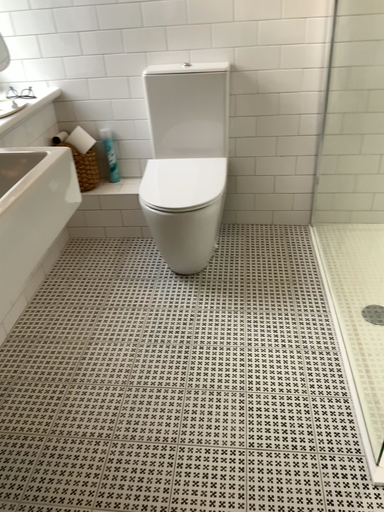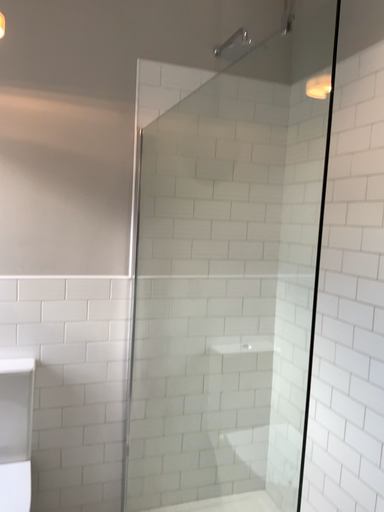
Question: How did the camera likely rotate when shooting the video?

Choices:
 (A) rotated right
 (B) rotated left

Answer: (A)